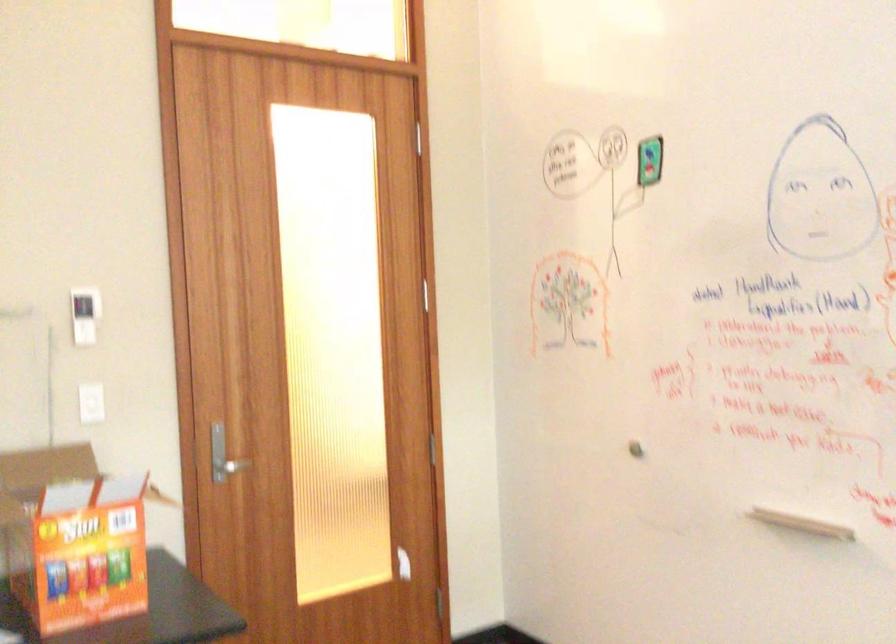
Where is `orange cardboard box`? orange cardboard box is located at coordinates (72, 538).